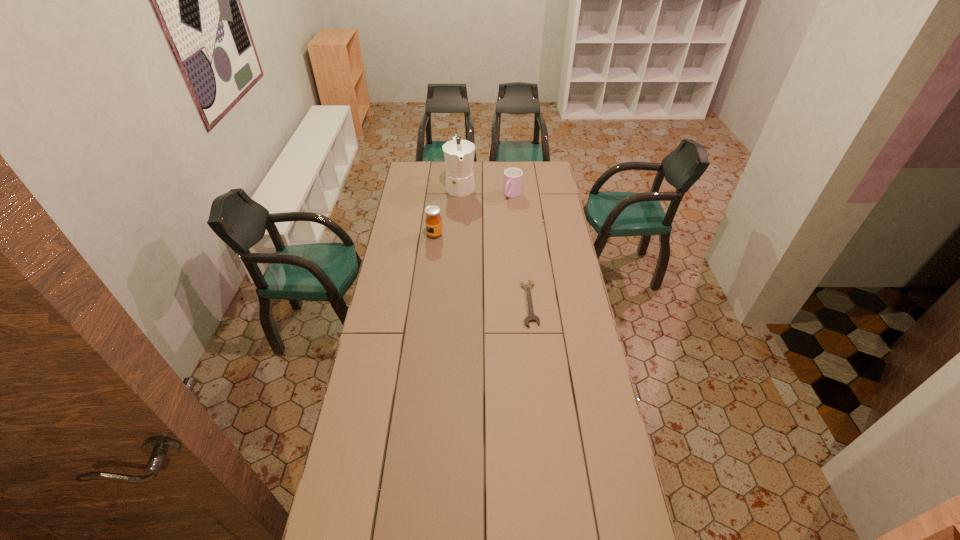
You are a GUI agent. You are given a task and a screenshot of the screen. Output one action in this format:
    pyautogui.click(x=<x>, y=<y>)
    Task: Click on the second nearest object
    
    Given the screenshot: What is the action you would take?
    pyautogui.click(x=433, y=221)

You are a GUI agent. You are given a task and a screenshot of the screen. Output one action in this format:
    pyautogui.click(x=<x>, y=<y>)
    Task: Click on the shortest object
    
    Given the screenshot: What is the action you would take?
    pyautogui.click(x=531, y=316)

The width and height of the screenshot is (960, 540). In order to click on the nearest object in this screenshot , I will do 531,316.

This screenshot has height=540, width=960. I want to click on the tallest object, so click(459, 154).

You are a GUI agent. You are given a task and a screenshot of the screen. Output one action in this format:
    pyautogui.click(x=<x>, y=<y>)
    Task: Click on the cup
    
    Given the screenshot: What is the action you would take?
    pyautogui.click(x=512, y=185)

Locate an element on the screen. free space located 0.150m on the left of the shortest object is located at coordinates (488, 303).

At what (x,y) coordinates should I click in order to perform the action: click on free location located 0.390m at the spout of the tallest object. Please return your answer as a coordinate pair (x, y). This screenshot has height=540, width=960. Looking at the image, I should click on (470, 244).

Identify the location of vacant area situated 0.160m at the spout of the tallest object. (465, 217).

The height and width of the screenshot is (540, 960). What are the coordinates of `vacant point located at the spout of the tallest object` in the screenshot? It's located at (470, 242).

I want to click on free spot located 0.150m with the handle on the side of the cup, so click(498, 215).